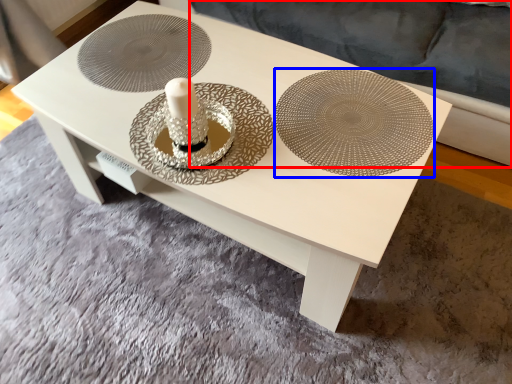
Question: Among these objects, which one is farthest to the camera, couch (highlighted by a red box) or plate (highlighted by a blue box)?

Choices:
 (A) couch
 (B) plate

Answer: (A)